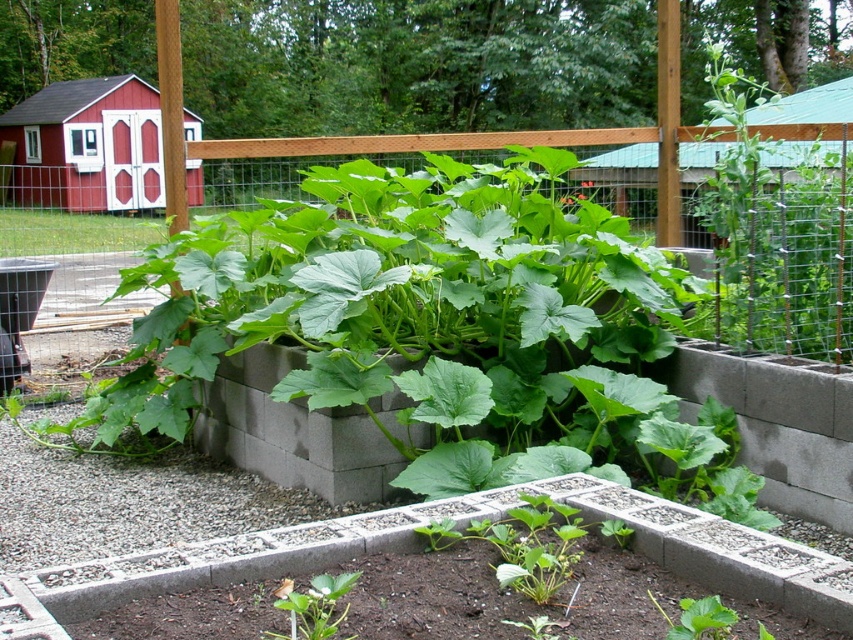
Who is higher up, wooden fence at upper center or green leafy plant at center?

wooden fence at upper center

Is wooden fence at upper center smaller than green leafy plant at center?

Actually, wooden fence at upper center might be larger than green leafy plant at center.

What are the coordinates of `wooden fence at upper center` in the screenshot? It's located at (468, 253).